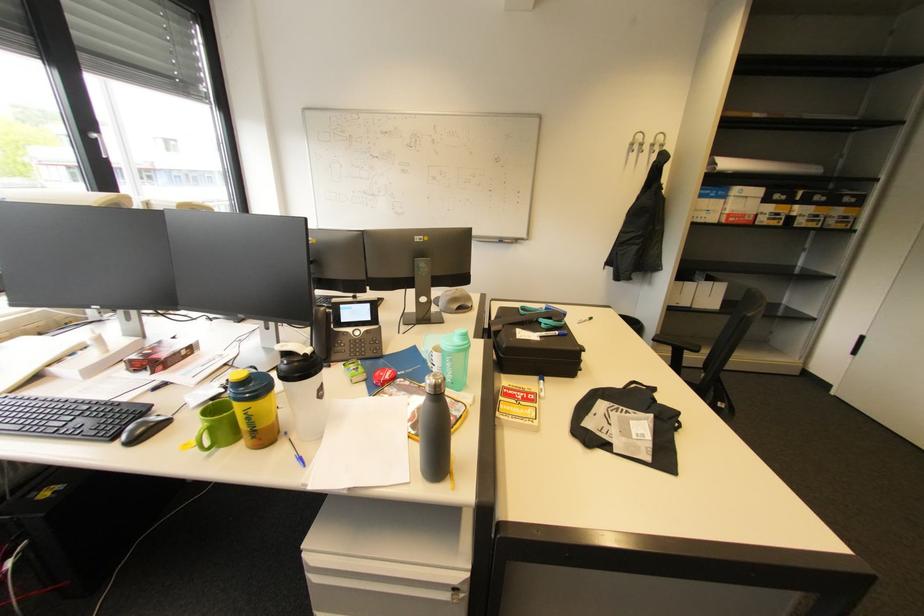
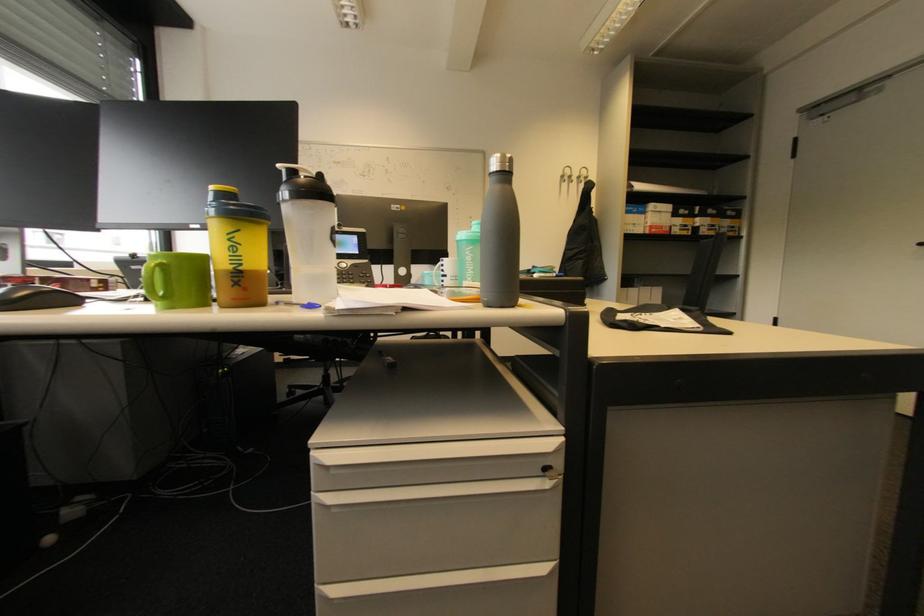
Locate, in the second image, the point that corresponds to (x=258, y=439) in the first image.

(239, 286)